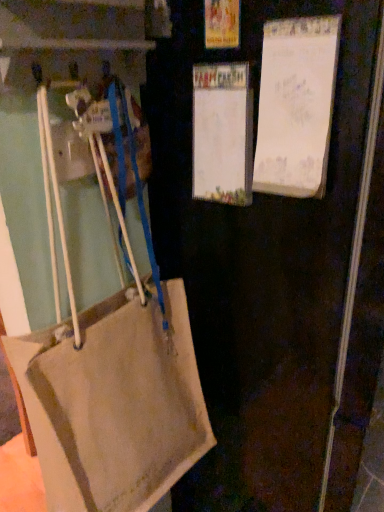
Question: Does point (304, 39) appear closer or farther from the camera than point (145, 288)?

Choices:
 (A) closer
 (B) farther

Answer: (A)

Question: From their relative heights in the image, would you say white paper at upper right, which appears as the first bulletin board when viewed from the right, is taller or shorter than beige canvas handbag at lower left?

Choices:
 (A) short
 (B) tall

Answer: (A)

Question: Which of these objects is positioned closest to the white paper at center, the 2th bulletin board viewed from the right?

Choices:
 (A) beige fabric bag at left
 (B) white paper at upper right, which appears as the first bulletin board when viewed from the right
 (C) beige canvas handbag at lower left

Answer: (B)

Question: Which is farther from the beige canvas handbag at lower left?

Choices:
 (A) white paper at center, which is counted as the 1th bulletin board, starting from the left
 (B) beige fabric bag at left
 (C) white paper at upper right, acting as the second bulletin board starting from the left

Answer: (C)